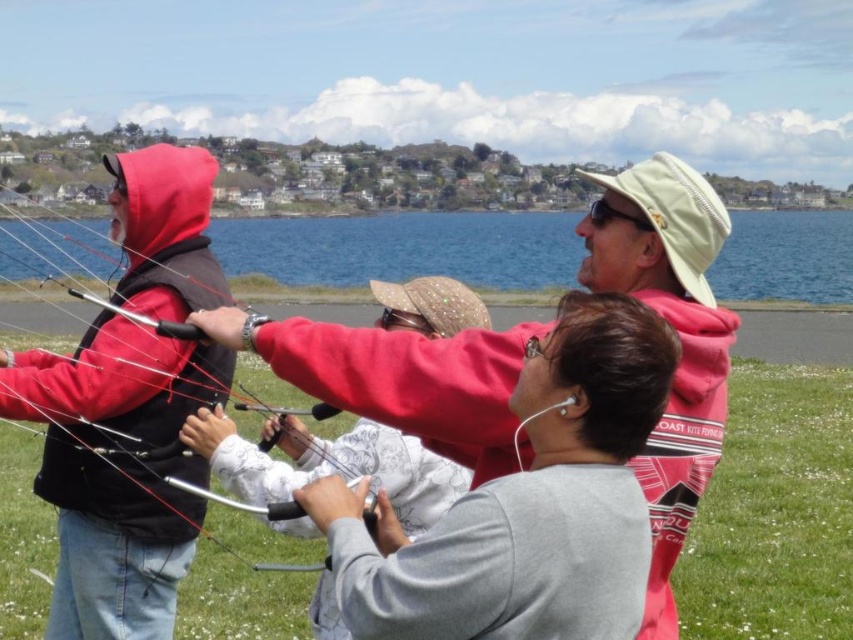
Question: Which of the following is the closest to the observer?

Choices:
 (A) matte red hoodie at center
 (B) blue water at upper center
 (C) metallic silver string at center

Answer: (A)

Question: Based on their relative distances, which object is nearer to the blue water at upper center?

Choices:
 (A) metallic silver string at center
 (B) matte red hoodie at center

Answer: (A)

Question: Is matte red hoodie at center above blue water at upper center?

Choices:
 (A) yes
 (B) no

Answer: (B)

Question: Is matte red hoodie at center below metallic silver string at center?

Choices:
 (A) yes
 (B) no

Answer: (B)

Question: Which is nearer to the blue water at upper center?

Choices:
 (A) matte red hoodie at center
 (B) metallic silver string at center

Answer: (B)

Question: Does matte red hoodie at center appear over metallic silver string at center?

Choices:
 (A) yes
 (B) no

Answer: (A)